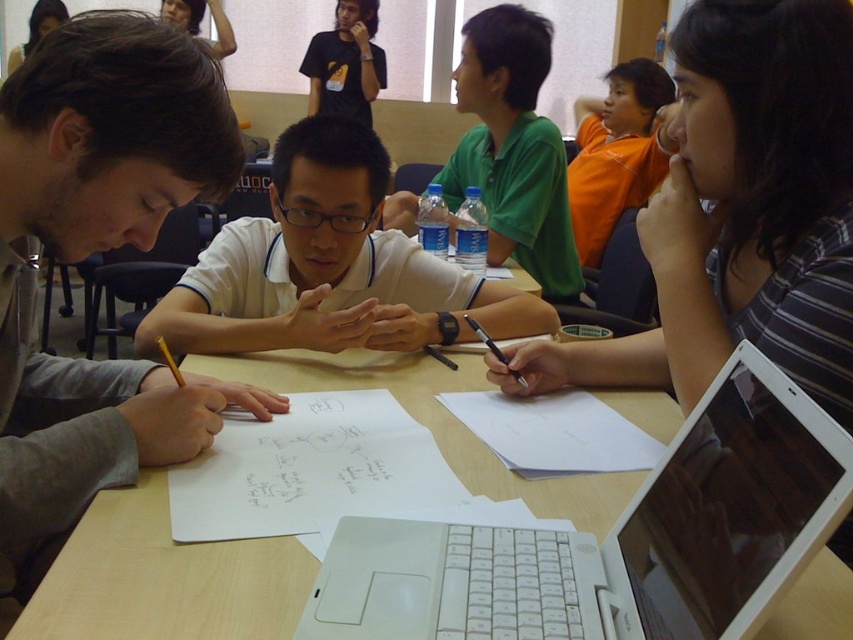
Can you confirm if green matte shirt at center is thinner than matte black t-shirt at upper center?

Incorrect, green matte shirt at center's width is not less than matte black t-shirt at upper center's.

In the scene shown: Does green matte shirt at center have a larger size compared to matte black t-shirt at upper center?

Correct, green matte shirt at center is larger in size than matte black t-shirt at upper center.

This screenshot has width=853, height=640. In order to click on green matte shirt at center in this screenshot , I will do `click(514, 148)`.

Does orange cotton shirt at upper center lie behind matte black hair at upper left?

No, orange cotton shirt at upper center is closer to the viewer.

Can you confirm if orange cotton shirt at upper center is smaller than matte black hair at upper left?

Incorrect, orange cotton shirt at upper center is not smaller in size than matte black hair at upper left.

Between point (647, 150) and point (64, 17), which one is positioned behind?

The point (64, 17) is behind.

Where is `orange cotton shirt at upper center`? orange cotton shirt at upper center is located at coordinates (616, 152).

Which is more to the left, white plastic laptop at center or orange cotton shirt at upper center?

Positioned to the left is white plastic laptop at center.

Can you confirm if white plastic laptop at center is bigger than orange cotton shirt at upper center?

Incorrect, white plastic laptop at center is not larger than orange cotton shirt at upper center.

Is point (662, 579) positioned in front of point (618, 86)?

Yes, it is in front of point (618, 86).

The height and width of the screenshot is (640, 853). What are the coordinates of `white plastic laptop at center` in the screenshot? It's located at (616, 540).